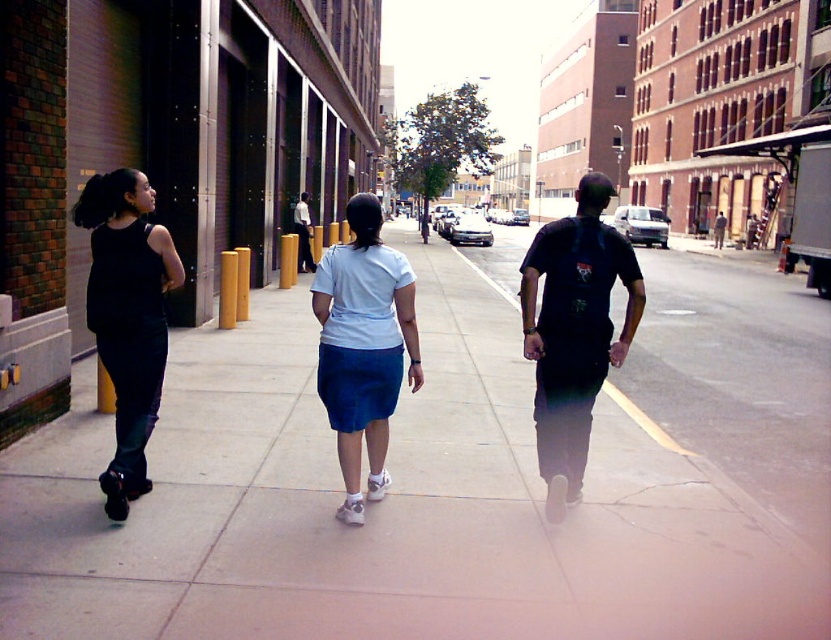
You are a pedestrian trying to avoid a puddle on the sidewalk. You see the dark blue backpack at center and the matte black tank top at left. Which object is closer to the left edge of the sidewalk?

The matte black tank top at left is closer to the left edge of the sidewalk because the dark blue backpack at center is to the right of it.

You are standing on the sidewalk and want to place a small potted plant between the smooth concrete sidewalk at center and the white matte skirt at center. Which object should the plant be closer to based on their positions?

The smooth concrete sidewalk at center is to the right of the white matte skirt at center, so the plant should be placed closer to the white matte skirt at center to be between them.

You are a delivery robot with a 2.5 meter reach. You need to place a package onto the dark blue backpack at center from the smooth concrete sidewalk at center. Can you do this without moving closer?

The distance between the smooth concrete sidewalk at center and the dark blue backpack at center is 3.10 meters. Since your reach is only 2.5 meters, you cannot place the package without moving closer.